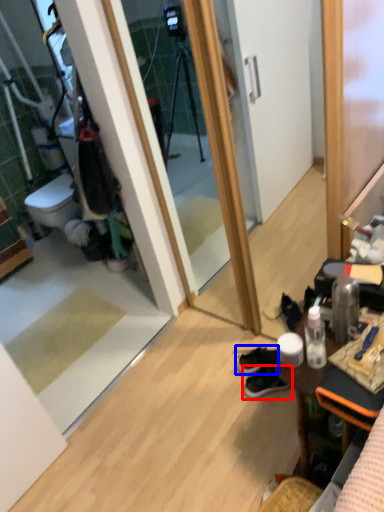
Question: Which of the following is the closest to the observer, footwear (highlighted by a red box) or footwear (highlighted by a blue box)?

Choices:
 (A) footwear
 (B) footwear

Answer: (A)